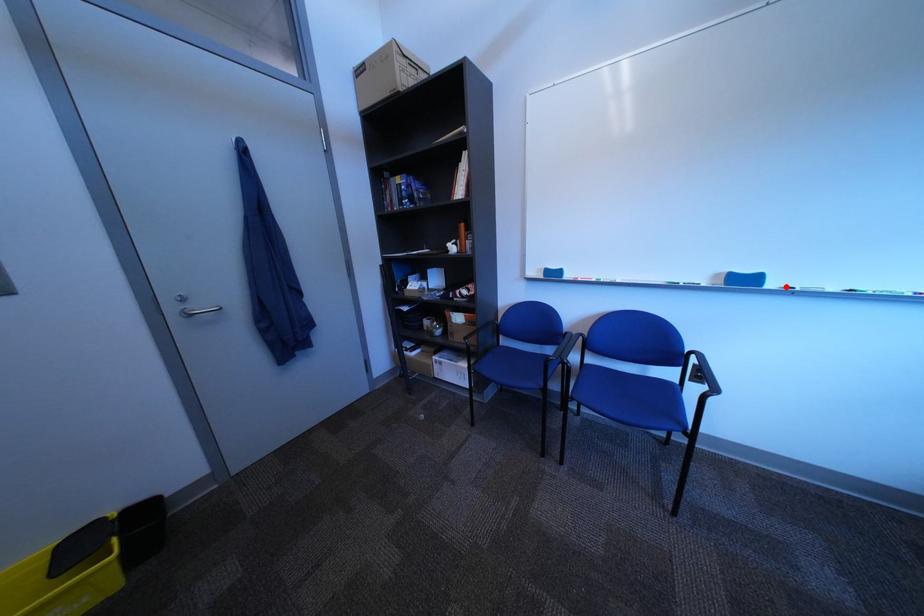
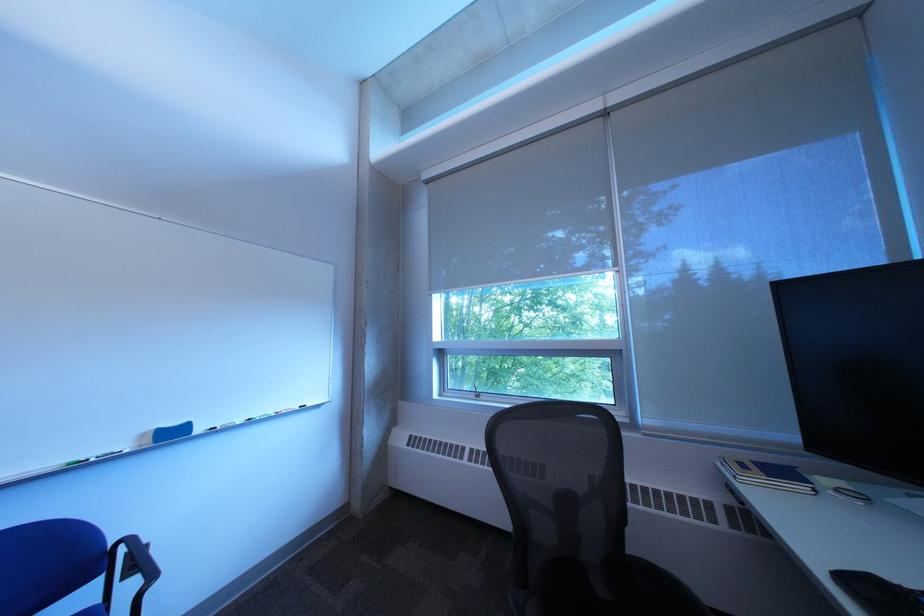
Find the pixel in the second image that matches the highlighted location in the first image.

(213, 432)